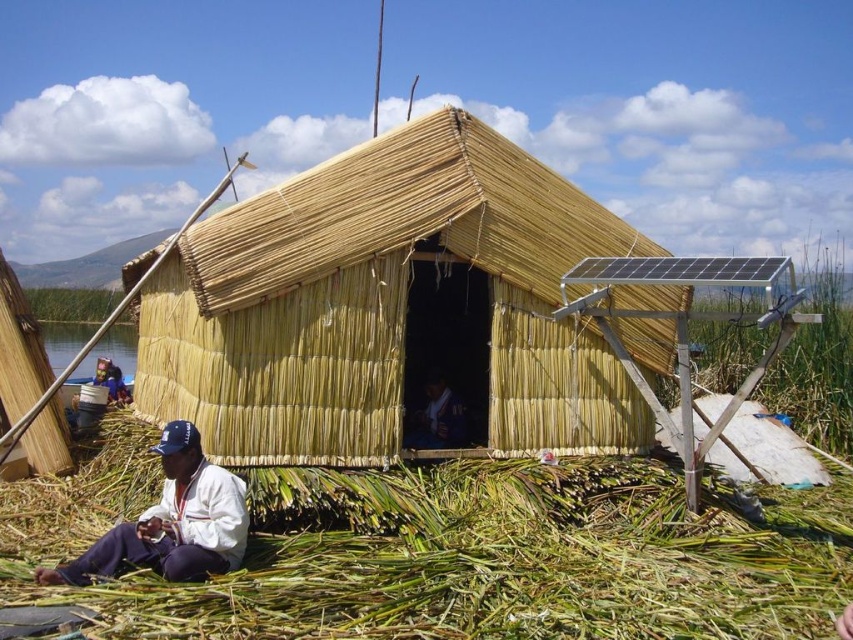
Between green grassy hay at lower center and dark blue fabric at center, which one appears on the left side from the viewer's perspective?

dark blue fabric at center

Is green grassy hay at lower center below dark blue fabric at center?

Indeed, green grassy hay at lower center is positioned under dark blue fabric at center.

Which is in front, point (641, 618) or point (450, 433)?

Positioned in front is point (641, 618).

Find the location of a particular element. This screenshot has width=853, height=640. green grassy hay at lower center is located at coordinates (473, 560).

Is straw-thatched hut at center wider than green grassy hay at lower center?

Yes.

Is point (604, 220) farther from viewer compared to point (0, 566)?

Yes, point (604, 220) is behind point (0, 566).

Image resolution: width=853 pixels, height=640 pixels. Find the location of `straw-thatched hut at center`. straw-thatched hut at center is located at coordinates (389, 307).

You are a GUI agent. You are given a task and a screenshot of the screen. Output one action in this format:
    pyautogui.click(x=<x>, y=<y>)
    Task: Click on the straw-thatched hut at center
    Image resolution: width=853 pixels, height=640 pixels.
    Given the screenshot: What is the action you would take?
    pyautogui.click(x=389, y=307)

Is point (154, 522) closer to camera compared to point (422, 424)?

Yes, point (154, 522) is closer to viewer.

Is white fabric at lower left thinner than dark blue fabric at center?

In fact, white fabric at lower left might be wider than dark blue fabric at center.

Is point (119, 554) positioned after point (456, 404)?

That is False.

Identify the location of white fabric at lower left. (171, 522).